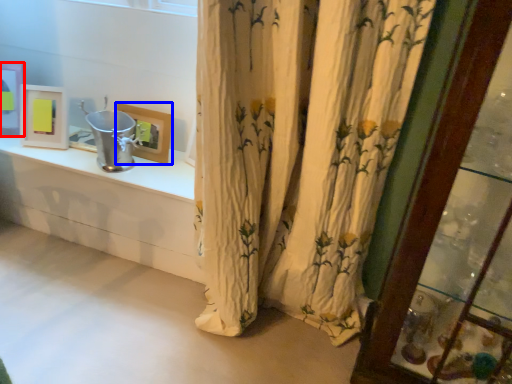
Question: Which object is further to the camera taking this photo, picture frame (highlighted by a red box) or picture frame (highlighted by a blue box)?

Choices:
 (A) picture frame
 (B) picture frame

Answer: (A)